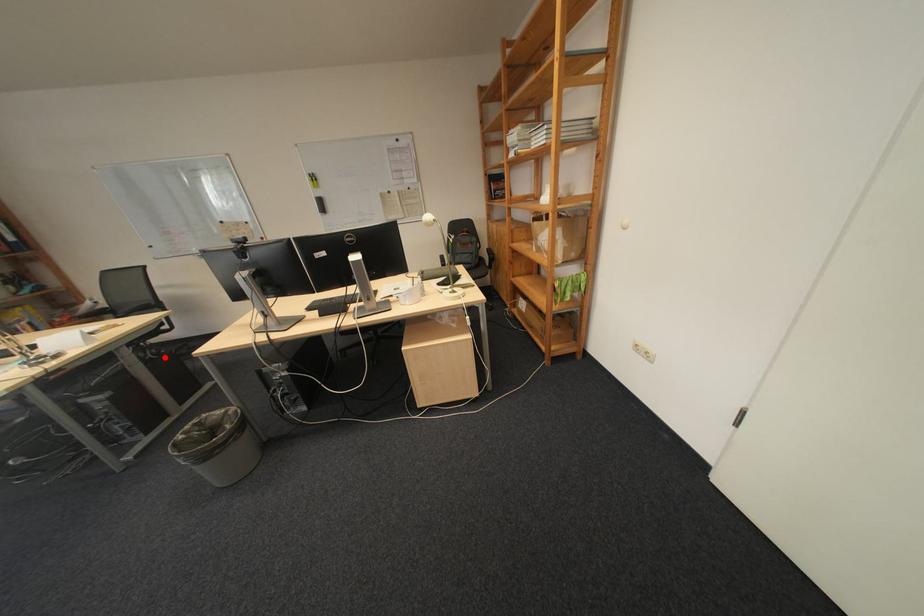
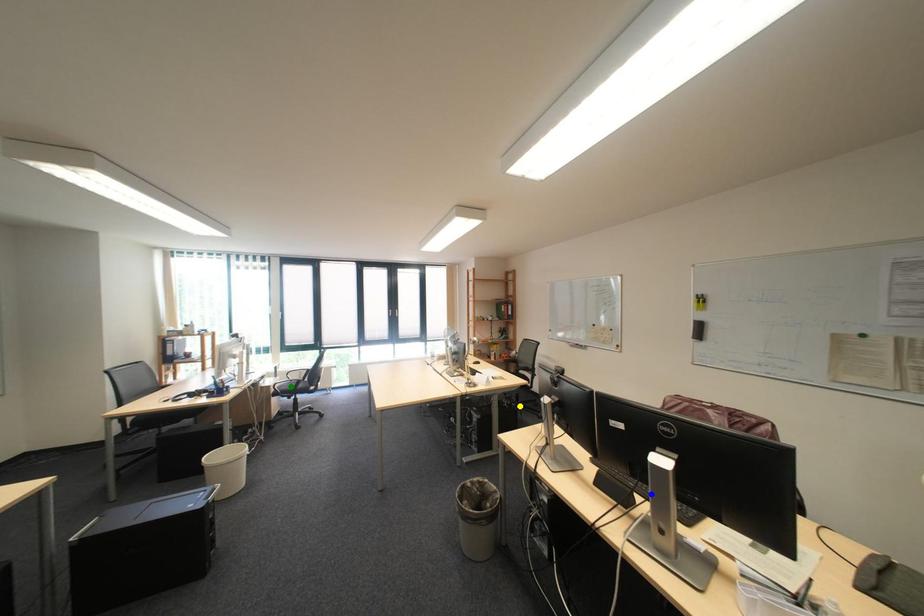
Question: I am providing you with two images of the same scene from different viewpoints. A red point is marked on the first image. You are given multiple points on the second image. In image 2, which mark is for the same physical point as the one in image 1?

Choices:
 (A) yellow point
 (B) green point
 (C) blue point

Answer: (A)